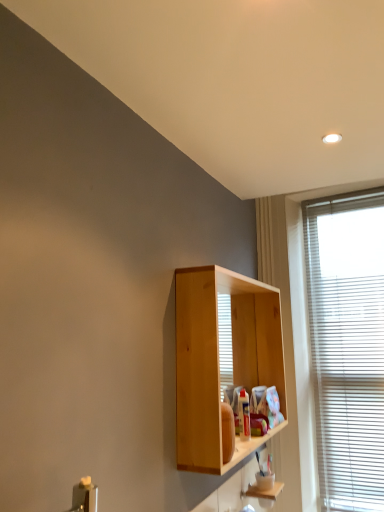
Question: Is wooden shelf at lower center thinner than wooden cabinet at lower right?

Choices:
 (A) no
 (B) yes

Answer: (A)

Question: Is there a large distance between wooden shelf at lower center and wooden cabinet at lower right?

Choices:
 (A) yes
 (B) no

Answer: (B)

Question: Does wooden shelf at lower center appear on the left side of wooden cabinet at lower right?

Choices:
 (A) yes
 (B) no

Answer: (A)

Question: From a real-world perspective, is wooden shelf at lower center on wooden cabinet at lower right?

Choices:
 (A) no
 (B) yes

Answer: (A)

Question: Is wooden shelf at lower center outside wooden cabinet at lower right?

Choices:
 (A) yes
 (B) no

Answer: (B)

Question: Considering the positions of wooden shelf at lower center and wooden cabinet at lower right in the image, is wooden shelf at lower center wider or thinner than wooden cabinet at lower right?

Choices:
 (A) wide
 (B) thin

Answer: (A)

Question: Is wooden shelf at lower center inside or outside of wooden cabinet at lower right?

Choices:
 (A) inside
 (B) outside

Answer: (A)

Question: From a real-world perspective, is wooden shelf at lower center physically located above or below wooden cabinet at lower right?

Choices:
 (A) above
 (B) below

Answer: (B)

Question: Based on their sizes in the image, would you say wooden shelf at lower center is bigger or smaller than wooden cabinet at lower right?

Choices:
 (A) small
 (B) big

Answer: (A)

Question: Considering the positions of white blinds at right and wooden cabinet at lower right in the image, is white blinds at right wider or thinner than wooden cabinet at lower right?

Choices:
 (A) thin
 (B) wide

Answer: (A)

Question: From the image's perspective, relative to wooden cabinet at lower right, is white blinds at right above or below?

Choices:
 (A) above
 (B) below

Answer: (A)

Question: From a real-world perspective, is white blinds at right above or below wooden cabinet at lower right?

Choices:
 (A) above
 (B) below

Answer: (A)

Question: Looking at the image, does white blinds at right seem bigger or smaller compared to wooden cabinet at lower right?

Choices:
 (A) small
 (B) big

Answer: (B)

Question: From a real-world perspective, is white blinds at right positioned above or below wooden shelf at lower center?

Choices:
 (A) above
 (B) below

Answer: (A)

Question: Choose the correct answer: Is white blinds at right inside wooden shelf at lower center or outside it?

Choices:
 (A) outside
 (B) inside

Answer: (A)